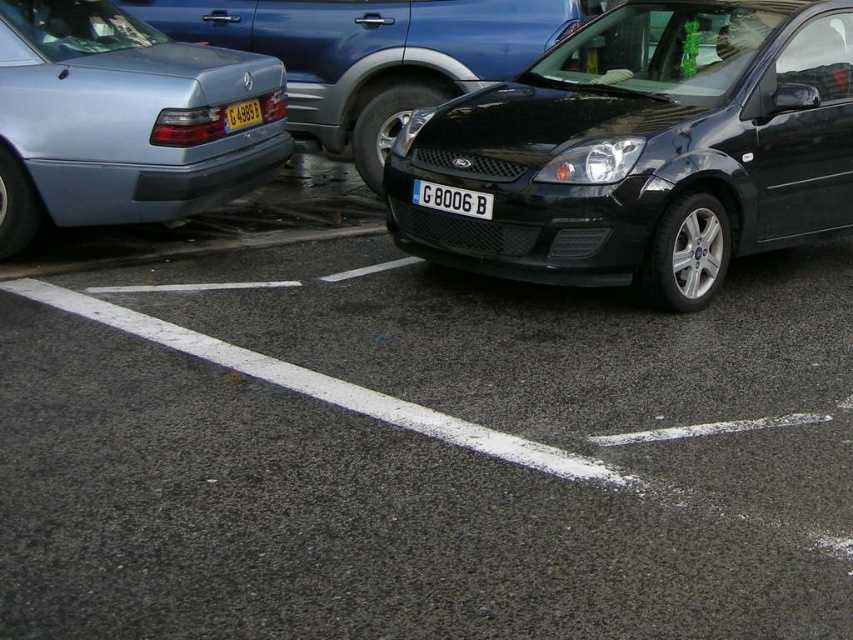
You are a delivery person trying to park your van in the parking lot. You see the black asphalt at center and the black glossy car at center. Which area is larger and suitable for parking your van?

The black asphalt at center is bigger than the black glossy car at center, so the black asphalt at center is suitable for parking your van.

Based on the photo, you are standing in the parking lot and want to walk from point (x=108, y=611) to point (x=819, y=99). Which direction should you move relative to the cars?

You should move towards the direction away from the light blue Mercedes on the left and towards the black Ford Focus on the right because point (x=108, y=611) is closer to the viewer than point (x=819, y=99), meaning the latter is further back in the parking lot.